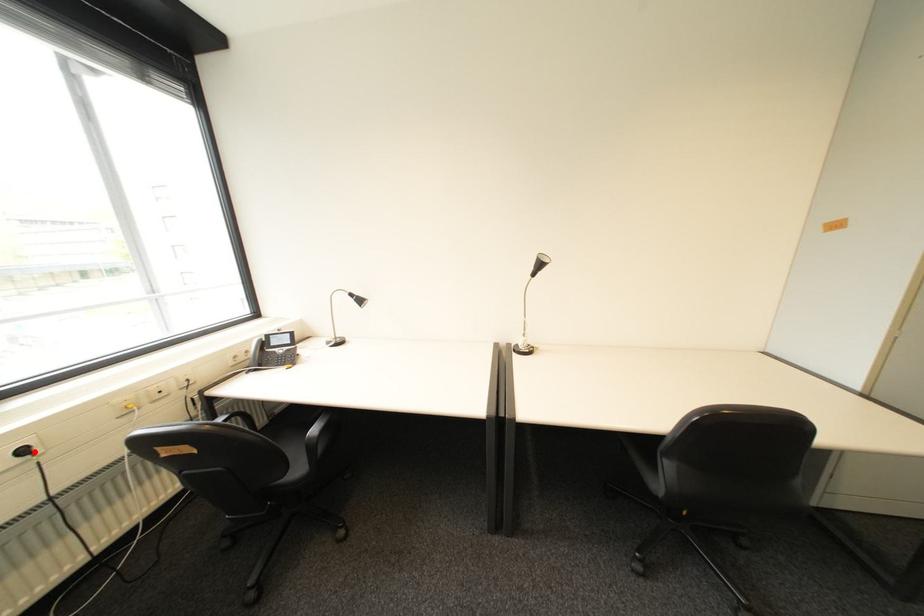
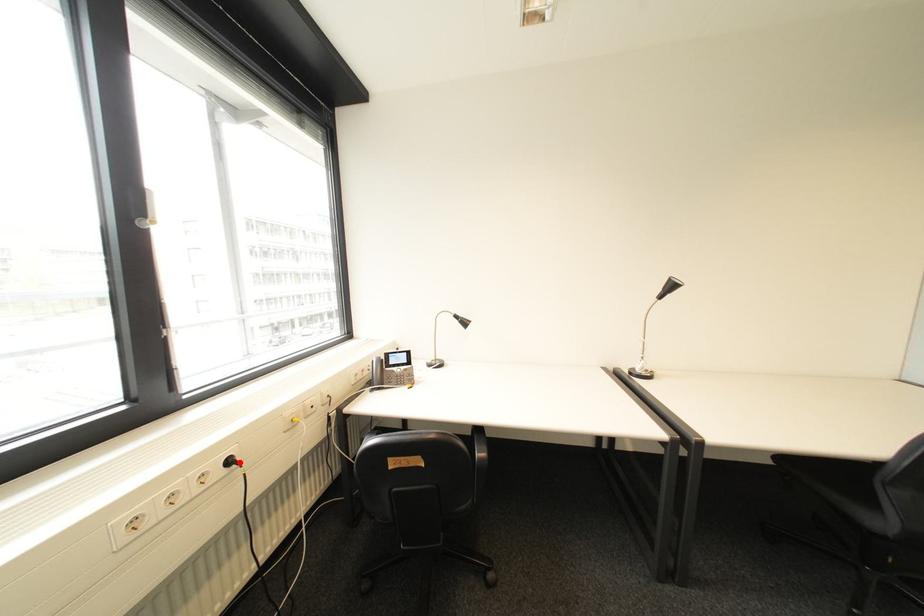
I am providing you with two images of the same scene from different viewpoints. A red point is marked on the first image and another point is marked on the second image. Is the red point in image1 aligned with the point shown in image2?

Yes